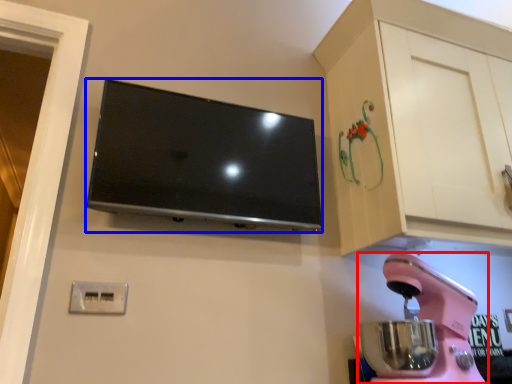
Question: Which of the following is the closest to the observer, home appliance (highlighted by a red box) or television (highlighted by a blue box)?

Choices:
 (A) home appliance
 (B) television

Answer: (A)